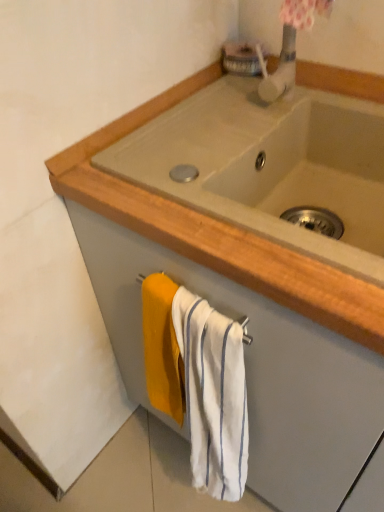
Question: Considering the positions of point (215, 490) and point (216, 197), is point (215, 490) closer or farther from the camera than point (216, 197)?

Choices:
 (A) closer
 (B) farther

Answer: (B)

Question: In terms of height, does white striped towel at lower center look taller or shorter compared to beige ceramic sink at center?

Choices:
 (A) short
 (B) tall

Answer: (B)

Question: Which is correct: white striped towel at lower center is inside beige ceramic sink at center, or outside of it?

Choices:
 (A) outside
 (B) inside

Answer: (A)

Question: Visually, is beige ceramic sink at center positioned to the left or to the right of white striped towel at lower center?

Choices:
 (A) right
 (B) left

Answer: (A)

Question: Does point (215, 135) appear closer or farther from the camera than point (205, 402)?

Choices:
 (A) closer
 (B) farther

Answer: (B)

Question: Is beige ceramic sink at center inside or outside of white striped towel at lower center?

Choices:
 (A) inside
 (B) outside

Answer: (B)

Question: From the image's perspective, is beige ceramic sink at center above or below white striped towel at lower center?

Choices:
 (A) above
 (B) below

Answer: (A)